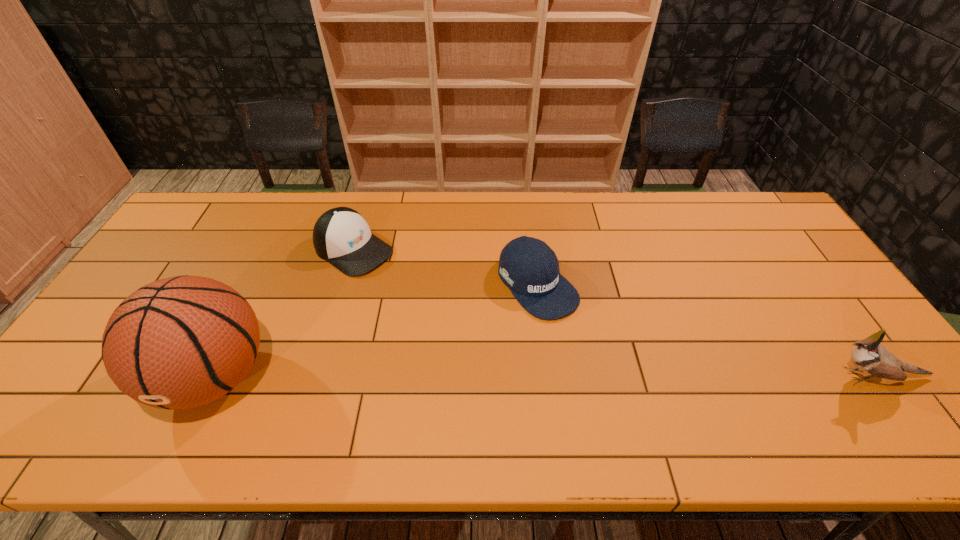
Find the location of a particular element. The height and width of the screenshot is (540, 960). free space between the cap and the bird is located at coordinates (614, 313).

Where is `empty space that is in between the basketball and the bird`? This screenshot has height=540, width=960. empty space that is in between the basketball and the bird is located at coordinates (544, 376).

Where is `object that is the third closest to the bird`? object that is the third closest to the bird is located at coordinates (181, 342).

Locate an element on the screen. Image resolution: width=960 pixels, height=540 pixels. object that stands as the closest to the rightmost object is located at coordinates (527, 266).

You are a GUI agent. You are given a task and a screenshot of the screen. Output one action in this format:
    pyautogui.click(x=<x>, y=<y>)
    Task: Click on the vacant space that satisfies the following two spatial constraints: 1. on the front side of the cap; 2. on the left side of the baseball cap
    The height and width of the screenshot is (540, 960).
    Given the screenshot: What is the action you would take?
    pyautogui.click(x=344, y=285)

Where is `vacant region that satisfies the following two spatial constraints: 1. on the front side of the third object from left to right; 2. on the right side of the cap`? Image resolution: width=960 pixels, height=540 pixels. vacant region that satisfies the following two spatial constraints: 1. on the front side of the third object from left to right; 2. on the right side of the cap is located at coordinates (344, 285).